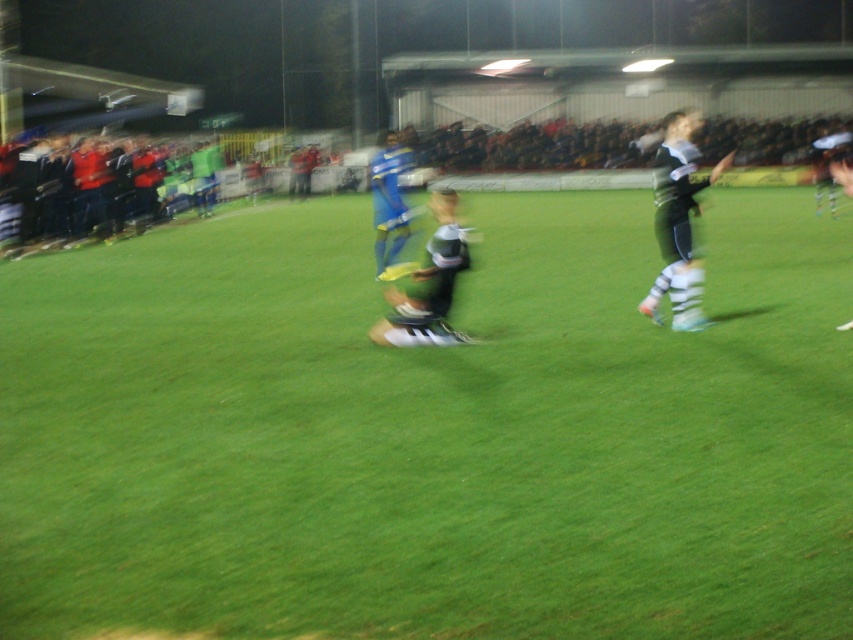
Question: Which of the following is the closest to the observer?

Choices:
 (A) green grass at center
 (B) dark green jersey at right
 (C) green jersey at center

Answer: (A)

Question: Can you confirm if dark green jersey at right is smaller than green jersey at center?

Choices:
 (A) no
 (B) yes

Answer: (A)

Question: Does green grass at center have a lesser width compared to green jersey at center?

Choices:
 (A) yes
 (B) no

Answer: (B)

Question: Does green grass at center appear under dark green jersey at right?

Choices:
 (A) yes
 (B) no

Answer: (A)

Question: Among these points, which one is farthest from the camera?

Choices:
 (A) (816, 529)
 (B) (656, 161)
 (C) (445, 189)

Answer: (B)

Question: Among these points, which one is farthest from the camera?

Choices:
 (A) (550, 225)
 (B) (432, 330)
 (C) (688, 202)

Answer: (A)